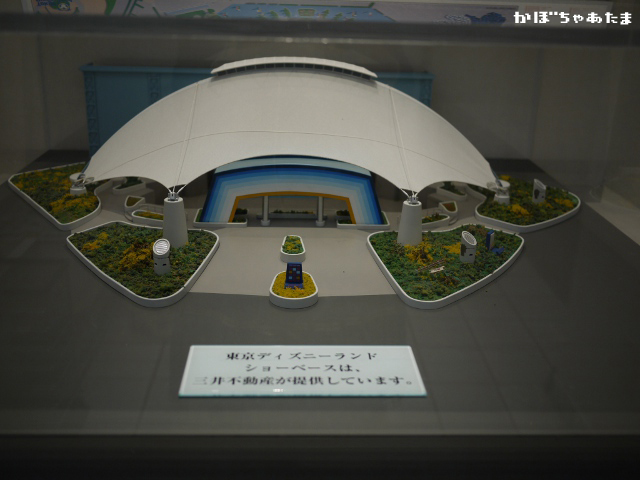
You are a GUI agent. You are given a task and a screenshot of the screen. Output one action in this format:
    pyautogui.click(x=<x>, y=<y>)
    Task: Click on the pillars
    This screenshot has width=640, height=480.
    Given the screenshot: What is the action you would take?
    pyautogui.click(x=413, y=221), pyautogui.click(x=500, y=194), pyautogui.click(x=172, y=235), pyautogui.click(x=77, y=188), pyautogui.click(x=262, y=221), pyautogui.click(x=324, y=217)